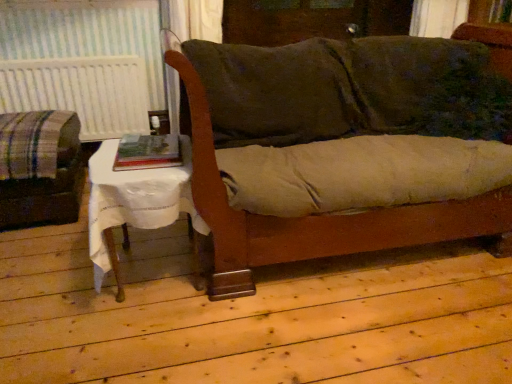
What do you see at coordinates (316, 216) in the screenshot? This screenshot has width=512, height=384. I see `velvet green couch at center` at bounding box center [316, 216].

Measure the distance between hardcover book at center and camera.

They are 1.53 meters apart.

Locate an element on the screen. Image resolution: width=512 pixels, height=384 pixels. velvet green couch at center is located at coordinates (316, 216).

Which of these two, white textured radiator at left or hardcover book at center, is smaller?

hardcover book at center is smaller.

Would you consider white textured radiator at left to be distant from hardcover book at center?

That's right, there is a large distance between white textured radiator at left and hardcover book at center.

Considering the sizes of objects white textured radiator at left and hardcover book at center in the image provided, who is thinner, white textured radiator at left or hardcover book at center?

With smaller width is white textured radiator at left.

Considering the relative sizes of velvet green couch at center and hardcover book at center in the image provided, is velvet green couch at center wider than hardcover book at center?

Yes, velvet green couch at center is wider than hardcover book at center.

Is velvet green couch at center turned away from hardcover book at center?

velvet green couch at center is not turned away from hardcover book at center.

From the image's perspective, is velvet green couch at center above hardcover book at center?

Yes, from the image's perspective, velvet green couch at center is over hardcover book at center.

Between white cloth-covered table at lower left and plaid fabric couch at left, which one has smaller size?

white cloth-covered table at lower left.

Is white cloth-covered table at lower left wider or thinner than plaid fabric couch at left?

Clearly, white cloth-covered table at lower left has less width compared to plaid fabric couch at left.

Is white cloth-covered table at lower left aimed at plaid fabric couch at left?

No, white cloth-covered table at lower left is not facing towards plaid fabric couch at left.

The image size is (512, 384). Identify the location of table in front of the plaid fabric couch at left. (135, 200).

Based on their sizes in the image, would you say white cloth-covered table at lower left is bigger or smaller than white textured radiator at left?

Result: Considering their sizes, white cloth-covered table at lower left takes up more space than white textured radiator at left.

Does point (111, 158) appear closer or farther from the camera than point (75, 63)?

Point (111, 158) is closer to the camera than point (75, 63).

Is white cloth-covered table at lower left next to white textured radiator at left?

No.

From a real-world perspective, which object stands above the other?

white textured radiator at left, from a real-world perspective.

In the image, is white textured radiator at left on the left side or the right side of velvet green couch at center?

white textured radiator at left is to the left of velvet green couch at center.

From the image's perspective, which one is positioned lower, white textured radiator at left or velvet green couch at center?

velvet green couch at center, from the image's perspective.

Can you confirm if white textured radiator at left is taller than velvet green couch at center?

Incorrect, the height of white textured radiator at left is not larger of that of velvet green couch at center.

Which of these two, plaid fabric couch at left or hardcover book at center, is thinner?

Thinner between the two is hardcover book at center.

Is plaid fabric couch at left completely or partially outside of hardcover book at center?

plaid fabric couch at left lies outside hardcover book at center's area.

Is plaid fabric couch at left facing away from hardcover book at center?

plaid fabric couch at left does not have its back to hardcover book at center.

Which object is further away from the camera, plaid fabric couch at left or hardcover book at center?

plaid fabric couch at left is further away from the camera.

Looking at this image, between white textured radiator at left and plaid fabric couch at left, which one appears on the right side from the viewer's perspective?

white textured radiator at left is more to the right.

Based on the photo, how much distance is there between white textured radiator at left and plaid fabric couch at left?

white textured radiator at left and plaid fabric couch at left are 23.34 inches apart from each other.

Would you consider white textured radiator at left to be distant from plaid fabric couch at left?

Actually, white textured radiator at left and plaid fabric couch at left are a little close together.

In the image, is white textured radiator at left positioned in front of or behind plaid fabric couch at left?

white textured radiator at left is behind plaid fabric couch at left.

In order to click on book that appears below the white textured radiator at left (from the image's perspective) in this screenshot , I will do `click(147, 152)`.

I want to click on couch below the hardcover book at center (from a real-world perspective), so click(x=316, y=216).

Considering their positions, is white cloth-covered table at lower left positioned closer to hardcover book at center than white textured radiator at left?

Based on the image, white cloth-covered table at lower left appears to be nearer to hardcover book at center.

Estimate the real-world distances between objects in this image. Which object is closer to white textured radiator at left, hardcover book at center or plaid fabric couch at left?

The object closer to white textured radiator at left is plaid fabric couch at left.

Based on their spatial positions, is velvet green couch at center or plaid fabric couch at left further from hardcover book at center?

Among the two, plaid fabric couch at left is located further to hardcover book at center.

From the image, which object appears to be farther from hardcover book at center, white cloth-covered table at lower left or velvet green couch at center?

The object further to hardcover book at center is velvet green couch at center.

From the image, which object appears to be farther from hardcover book at center, velvet green couch at center or white textured radiator at left?

Among the two, white textured radiator at left is located further to hardcover book at center.

Based on their spatial positions, is plaid fabric couch at left or hardcover book at center further from white textured radiator at left?

hardcover book at center is further to white textured radiator at left.

Looking at the image, which one is located closer to velvet green couch at center, plaid fabric couch at left or white cloth-covered table at lower left?

white cloth-covered table at lower left is closer to velvet green couch at center.

From the image, which object appears to be farther from hardcover book at center, white textured radiator at left or white cloth-covered table at lower left?

white textured radiator at left.

Where is `book between white textured radiator at left and velvet green couch at center in the horizontal direction`? Image resolution: width=512 pixels, height=384 pixels. book between white textured radiator at left and velvet green couch at center in the horizontal direction is located at coordinates (147, 152).

Where is `book between white cloth-covered table at lower left and velvet green couch at center in the horizontal direction`? The image size is (512, 384). book between white cloth-covered table at lower left and velvet green couch at center in the horizontal direction is located at coordinates (147, 152).

The height and width of the screenshot is (384, 512). I want to click on table located between plaid fabric couch at left and velvet green couch at center in the left-right direction, so click(x=135, y=200).

The image size is (512, 384). I want to click on radiator located between plaid fabric couch at left and velvet green couch at center in the left-right direction, so click(x=81, y=92).